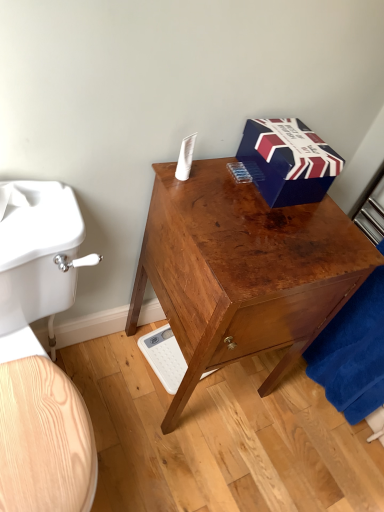
Find the location of `free point to the right of white plastic scale at lower center`. free point to the right of white plastic scale at lower center is located at coordinates (237, 391).